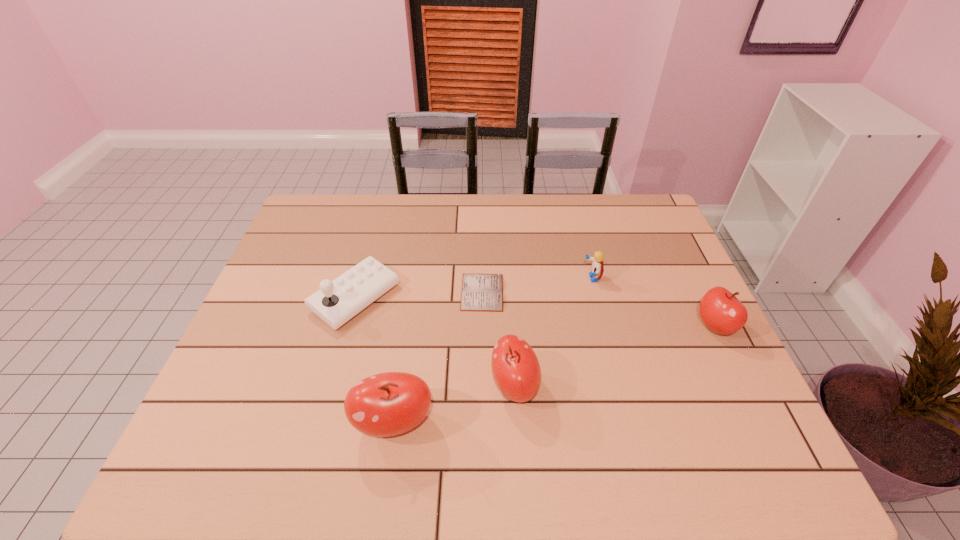
Where is `the leftmost apple`? The height and width of the screenshot is (540, 960). the leftmost apple is located at coordinates (387, 404).

This screenshot has width=960, height=540. What are the coordinates of `the second apple from left to right` in the screenshot? It's located at (516, 369).

The height and width of the screenshot is (540, 960). In order to click on the second tallest apple in this screenshot , I will do `click(516, 369)`.

This screenshot has height=540, width=960. Find the location of `the rightmost object`. the rightmost object is located at coordinates (721, 311).

Find the location of a particular element. The width and height of the screenshot is (960, 540). the shortest apple is located at coordinates (721, 311).

Find the location of `joystick`. joystick is located at coordinates (337, 301).

Where is `the shortest object`? This screenshot has width=960, height=540. the shortest object is located at coordinates (480, 292).

Identify the location of the second shortest object. This screenshot has height=540, width=960. (597, 267).

Locate an element on the screen. The height and width of the screenshot is (540, 960). the second object from right to left is located at coordinates (597, 267).

Image resolution: width=960 pixels, height=540 pixels. In order to click on free location located 0.270m on the back of the leftmost apple in this screenshot , I will do `click(411, 309)`.